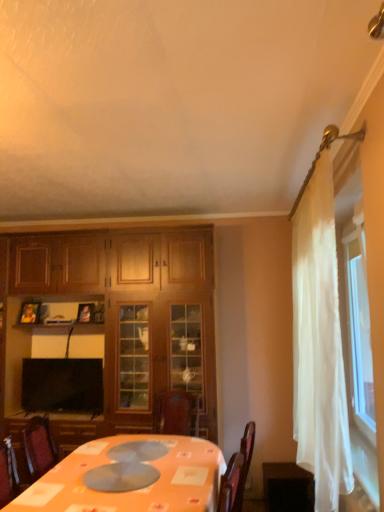
Locate an element on the screen. The width and height of the screenshot is (384, 512). vacant area on top of orange fabric table at lower center (from a real-world perspective) is located at coordinates (136, 460).